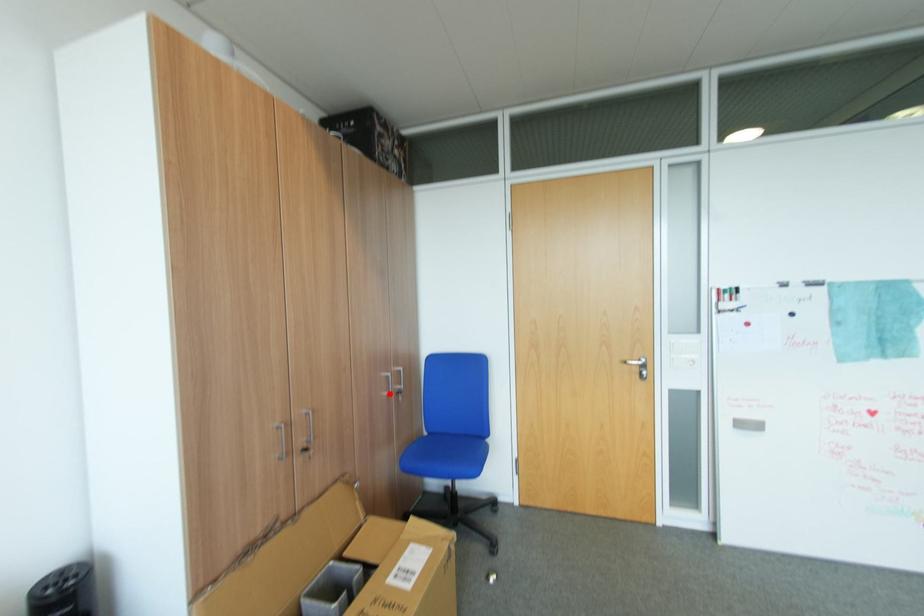
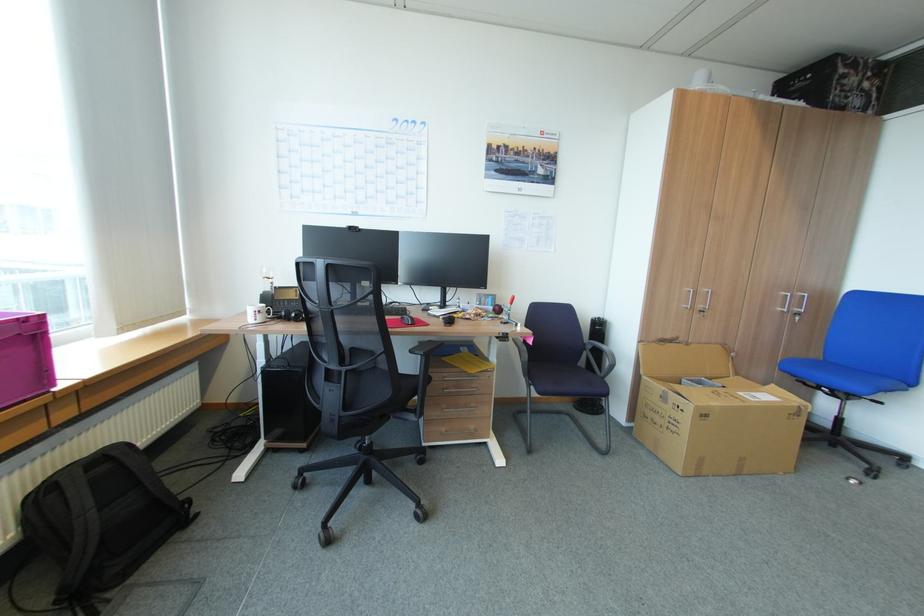
In the second image, find the point that corresponds to the highlighted location in the first image.

(785, 309)